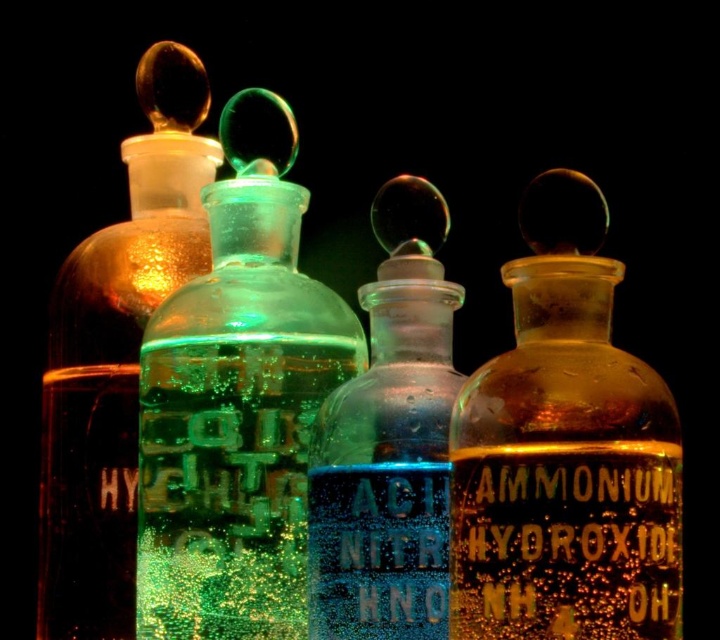
Question: Can you confirm if amber glass bottle at center is bigger than blue glass bottle at center?

Choices:
 (A) no
 (B) yes

Answer: (B)

Question: Among these objects, which one is nearest to the camera?

Choices:
 (A) green frosted glass bottle at center
 (B) translucent amber glass bottle at left

Answer: (A)

Question: Does amber glass bottle at center have a smaller size compared to green frosted glass bottle at center?

Choices:
 (A) yes
 (B) no

Answer: (A)

Question: Which point appears farthest from the camera in this image?

Choices:
 (A) (590, 294)
 (B) (408, 593)
 (C) (186, 202)

Answer: (C)

Question: Which object appears farthest from the camera in this image?

Choices:
 (A) green frosted glass bottle at center
 (B) amber glass bottle at center
 (C) translucent amber glass bottle at left

Answer: (C)

Question: Does amber glass bottle at center appear on the right side of green frosted glass bottle at center?

Choices:
 (A) no
 (B) yes

Answer: (B)